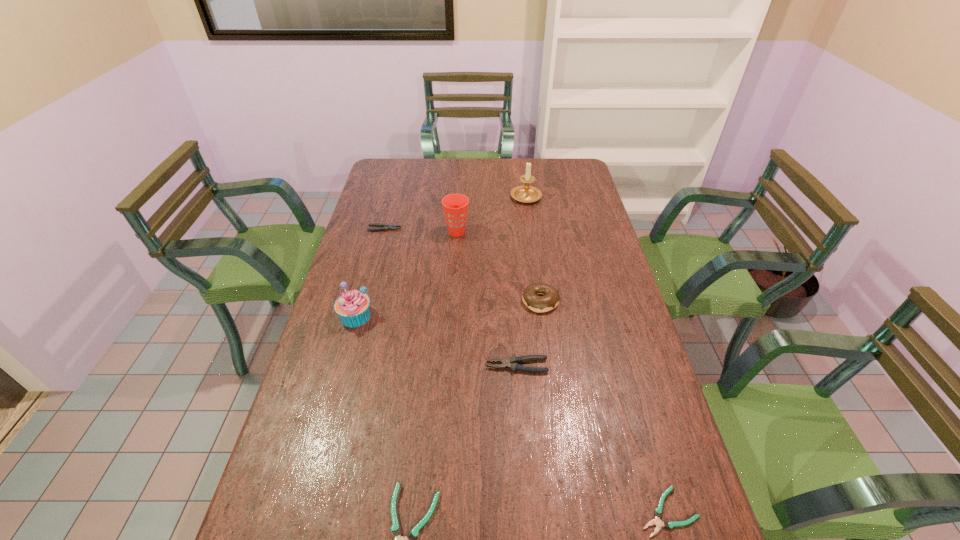
You are a GUI agent. You are given a task and a screenshot of the screen. Output one action in this format:
    pyautogui.click(x=<x>, y=<y>)
    Task: Click on the free point located 0.080m at the gripping part of the right gray pliers
    
    Given the screenshot: What is the action you would take?
    pyautogui.click(x=458, y=366)

Find the location of a particular element. vacant space located 0.260m at the gripping part of the right gray pliers is located at coordinates (393, 366).

This screenshot has height=540, width=960. In order to click on vacant point located 0.090m at the gripping part of the farthest pliers in this screenshot , I will do `click(425, 229)`.

Where is `free region located on the back of the rightmost pliers`? The image size is (960, 540). free region located on the back of the rightmost pliers is located at coordinates (622, 355).

Where is `muffin that is at the left edge`? Image resolution: width=960 pixels, height=540 pixels. muffin that is at the left edge is located at coordinates (353, 307).

Where is `pliers positioned at the left edge`? pliers positioned at the left edge is located at coordinates (385, 227).

This screenshot has height=540, width=960. In order to click on object that is positioned at the right edge in this screenshot , I will do `click(668, 524)`.

Where is `vacant space at the far edge of the desktop`? vacant space at the far edge of the desktop is located at coordinates (494, 159).

Image resolution: width=960 pixels, height=540 pixels. In the image, there is a desktop. In order to click on free region at the left edge in this screenshot , I will do `click(372, 213)`.

The height and width of the screenshot is (540, 960). Find the location of `vacant space at the right edge`. vacant space at the right edge is located at coordinates (671, 456).